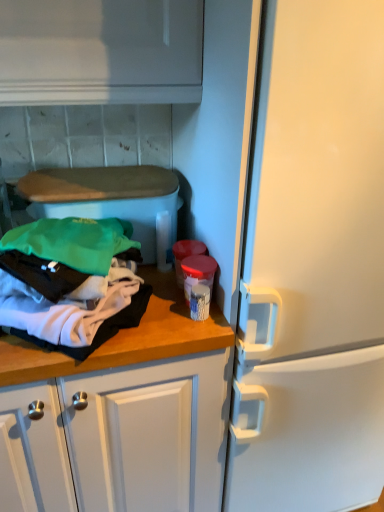
Describe the element at coordinates (69, 283) in the screenshot. Image resolution: width=384 pixels, height=512 pixels. I see `soft cotton clothes at left` at that location.

What are the coordinates of `soft cotton clothes at left` in the screenshot? It's located at (69, 283).

Measure the distance between point (98, 287) and camera.

Point (98, 287) is 90.60 centimeters away from camera.

The image size is (384, 512). I want to click on wooden at left, so click(x=125, y=339).

Measure the distance between wooden at left and camera.

wooden at left is 85.00 centimeters away from camera.

What do you see at coordinates (125, 339) in the screenshot? I see `wooden at left` at bounding box center [125, 339].

Identify the location of soft cotton clothes at left. (69, 283).

Is wooden at left to the right of soft cotton clothes at left from the viewer's perspective?

Yes, wooden at left is to the right of soft cotton clothes at left.

Is wooden at left positioned before soft cotton clothes at left?

No, wooden at left is further to the viewer.

Which is behind, point (203, 346) or point (73, 241)?

Point (203, 346)

From the image's perspective, would you say wooden at left is shown under soft cotton clothes at left?

Yes, from the image's perspective, wooden at left is beneath soft cotton clothes at left.

From a real-world perspective, is wooden at left physically located above or below soft cotton clothes at left?

wooden at left is below soft cotton clothes at left.

Which of these two, wooden at left or soft cotton clothes at left, is wider?

soft cotton clothes at left is wider.

Considering the sizes of wooden at left and soft cotton clothes at left in the image, is wooden at left taller or shorter than soft cotton clothes at left?

Considering their sizes, wooden at left has less height than soft cotton clothes at left.

Looking at this image, who is smaller, wooden at left or soft cotton clothes at left?

With smaller size is wooden at left.

Can soft cotton clothes at left be found inside wooden at left?

That's incorrect, soft cotton clothes at left is not inside wooden at left.

Is wooden at left far away from soft cotton clothes at left?

No.

Looking at this image, is wooden at left aimed at soft cotton clothes at left?

No, wooden at left is not oriented towards soft cotton clothes at left.

How many degrees apart are the facing directions of wooden at left and soft cotton clothes at left?

The angular difference between wooden at left and soft cotton clothes at left is 0.00319 degrees.

Measure the distance between wooden at left and soft cotton clothes at left.

wooden at left is 4.28 inches away from soft cotton clothes at left.

You are a GUI agent. You are given a task and a screenshot of the screen. Output one action in this format:
    pyautogui.click(x=<x>, y=<y>)
    Task: Click on the clothing to the left of wooden at left
    This screenshot has height=512, width=384.
    Given the screenshot: What is the action you would take?
    pyautogui.click(x=69, y=283)

Considering the relative positions of soft cotton clothes at left and wooden at left in the image provided, is soft cotton clothes at left to the right of wooden at left from the viewer's perspective?

No, soft cotton clothes at left is not to the right of wooden at left.

Is the depth of soft cotton clothes at left greater than that of wooden at left?

No.

Is point (74, 322) farther from viewer compared to point (47, 366)?

That is False.

From the image's perspective, relative to wooden at left, is soft cotton clothes at left above or below?

soft cotton clothes at left is situated higher than wooden at left in the image.

From a real-world perspective, relative to wooden at left, is soft cotton clothes at left vertically above or below?

soft cotton clothes at left is situated higher than wooden at left in the real world.

Which object is wider, soft cotton clothes at left or wooden at left?

With larger width is soft cotton clothes at left.

Can you confirm if soft cotton clothes at left is taller than wooden at left?

Yes.

Based on their sizes in the image, would you say soft cotton clothes at left is bigger or smaller than wooden at left?

Clearly, soft cotton clothes at left is larger in size than wooden at left.

Choose the correct answer: Is soft cotton clothes at left inside wooden at left or outside it?

soft cotton clothes at left lies outside wooden at left.

Consider the image. Are soft cotton clothes at left and wooden at left beside each other?

soft cotton clothes at left and wooden at left are clearly separated.

Does soft cotton clothes at left turn towards wooden at left?

No, soft cotton clothes at left is not turned towards wooden at left.

Based on the photo, how many degrees apart are the facing directions of soft cotton clothes at left and wooden at left?

0.00319 degrees.

How much distance is there between soft cotton clothes at left and wooden at left?

A distance of 4.28 inches exists between soft cotton clothes at left and wooden at left.

The image size is (384, 512). I want to click on countertop on the right of soft cotton clothes at left, so click(125, 339).

Identify the location of countertop below the soft cotton clothes at left (from the image's perspective). (125, 339).

Where is `clothing in front of the wooden at left`? clothing in front of the wooden at left is located at coordinates (69, 283).